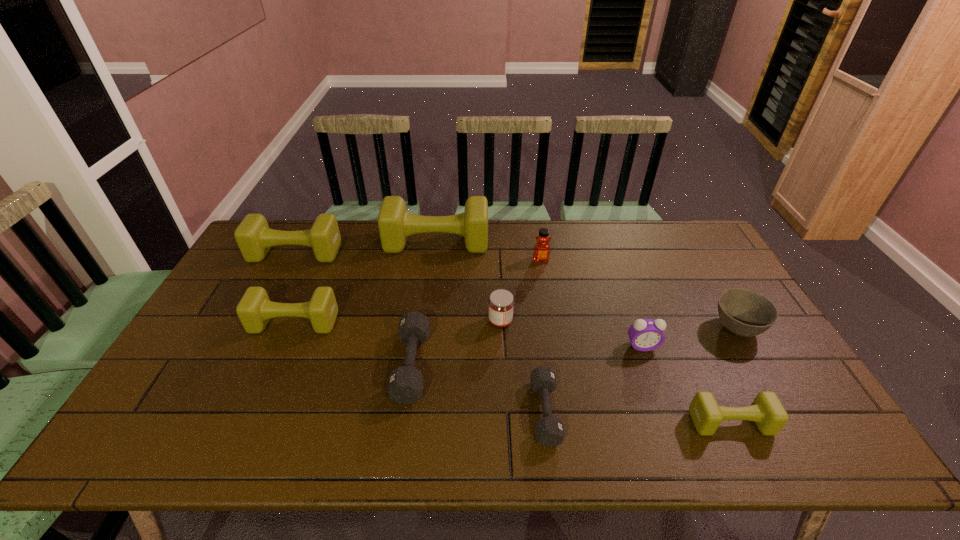
Identify which olive dumbbell is the second closest to the second smallest olive dumbbell. Please provide its 2D coordinates. Your answer should be formatted as a tuple, i.e. [(x, y)], where the tuple contains the x and y coordinates of a point satisfying the conditions above.

[(395, 224)]

Identify the location of vacant point that satisfies the following two spatial constraints: 1. on the face of the nearest olive dumbbell; 2. on the right side of the third object from right to left. This screenshot has height=540, width=960. (670, 422).

This screenshot has height=540, width=960. Identify the location of free location that satisfies the following two spatial constraints: 1. on the front label of the smallest olive dumbbell; 2. on the left side of the honey. (568, 422).